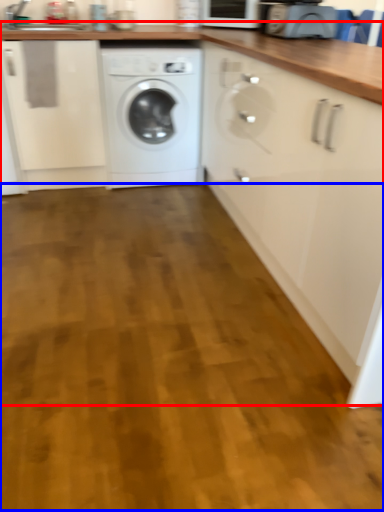
Question: Which object appears closest to the camera in this image, counter (highlighted by a red box) or plain (highlighted by a blue box)?

Choices:
 (A) counter
 (B) plain

Answer: (A)